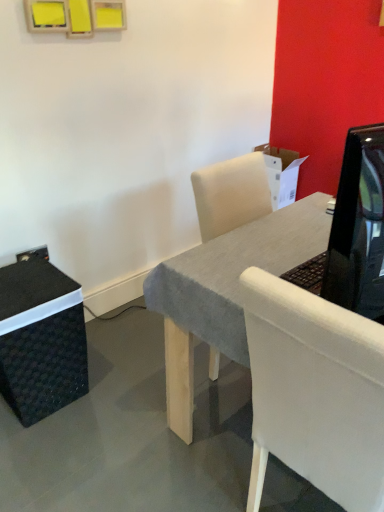
Question: From a real-world perspective, is shiny black tv at right beneath white fabric chair at center?

Choices:
 (A) yes
 (B) no

Answer: (B)

Question: Does shiny black tv at right have a larger size compared to white fabric chair at center?

Choices:
 (A) no
 (B) yes

Answer: (A)

Question: Is shiny black tv at right next to white fabric chair at center and touching it?

Choices:
 (A) no
 (B) yes

Answer: (A)

Question: Considering the relative positions of shiny black tv at right and white fabric chair at center in the image provided, is shiny black tv at right behind white fabric chair at center?

Choices:
 (A) no
 (B) yes

Answer: (A)

Question: From a real-world perspective, is shiny black tv at right on top of white fabric chair at center?

Choices:
 (A) no
 (B) yes

Answer: (B)

Question: Does shiny black tv at right appear on the left side of white fabric chair at center?

Choices:
 (A) yes
 (B) no

Answer: (A)

Question: Is white fabric chair at center not near black woven box at lower left?

Choices:
 (A) yes
 (B) no

Answer: (B)

Question: From a real-world perspective, is white fabric chair at center positioned over black woven box at lower left based on gravity?

Choices:
 (A) no
 (B) yes

Answer: (B)

Question: Does white fabric chair at center have a larger size compared to black woven box at lower left?

Choices:
 (A) yes
 (B) no

Answer: (A)

Question: From the image's perspective, is white fabric chair at center on top of black woven box at lower left?

Choices:
 (A) yes
 (B) no

Answer: (B)

Question: Considering the relative sizes of white fabric chair at center and black woven box at lower left in the image provided, is white fabric chair at center wider than black woven box at lower left?

Choices:
 (A) yes
 (B) no

Answer: (A)

Question: Is white fabric chair at center taller than black woven box at lower left?

Choices:
 (A) yes
 (B) no

Answer: (A)

Question: Is black woven box at lower left oriented towards shiny black tv at right?

Choices:
 (A) yes
 (B) no

Answer: (A)